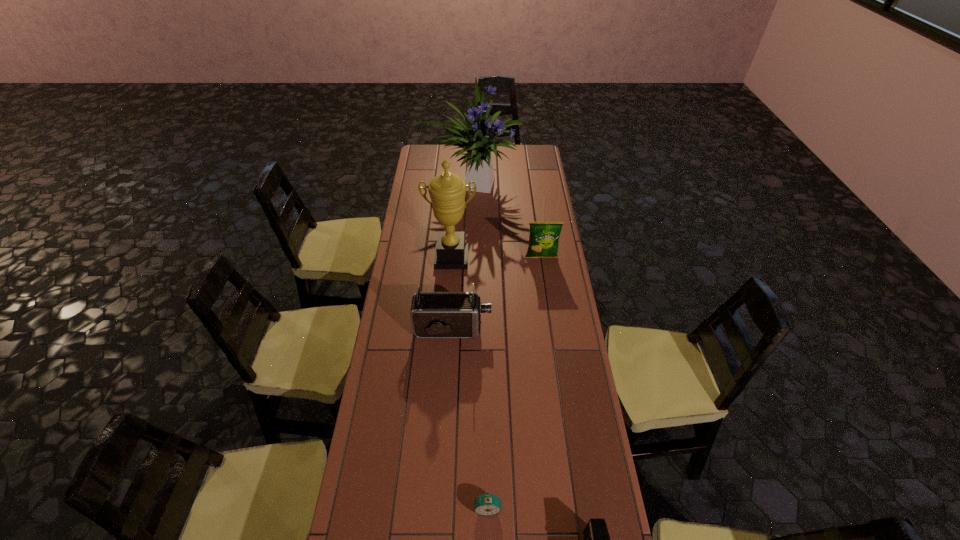
You are a GUI agent. You are given a task and a screenshot of the screen. Output one action in this format:
    pyautogui.click(x=<x>, y=<y>)
    Task: Click on the fifth closest object relative to the trophy cup
    Image resolution: width=960 pixels, height=540 pixels.
    Given the screenshot: What is the action you would take?
    pyautogui.click(x=596, y=537)